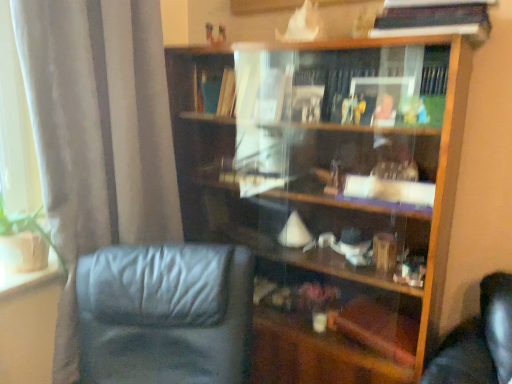
Question: Considering the relative sizes of black leather chair at lower left and hardcover book at upper right in the image provided, is black leather chair at lower left taller than hardcover book at upper right?

Choices:
 (A) yes
 (B) no

Answer: (A)

Question: From a real-world perspective, does black leather chair at lower left stand above hardcover book at upper right?

Choices:
 (A) yes
 (B) no

Answer: (B)

Question: Considering the relative positions of black leather chair at lower left and hardcover book at upper right in the image provided, is black leather chair at lower left to the left of hardcover book at upper right from the viewer's perspective?

Choices:
 (A) yes
 (B) no

Answer: (A)

Question: Considering the relative sizes of black leather chair at lower left and hardcover book at upper right in the image provided, is black leather chair at lower left wider than hardcover book at upper right?

Choices:
 (A) yes
 (B) no

Answer: (A)

Question: Is black leather chair at lower left at the right side of hardcover book at upper right?

Choices:
 (A) no
 (B) yes

Answer: (A)

Question: Considering the positions of hardcover book at upper right and wooden bookcase at center in the image, is hardcover book at upper right taller or shorter than wooden bookcase at center?

Choices:
 (A) tall
 (B) short

Answer: (B)

Question: Does point (415, 14) appear closer or farther from the camera than point (425, 225)?

Choices:
 (A) farther
 (B) closer

Answer: (B)

Question: In terms of size, does hardcover book at upper right appear bigger or smaller than wooden bookcase at center?

Choices:
 (A) small
 (B) big

Answer: (A)

Question: From a real-world perspective, relative to wooden bookcase at center, is hardcover book at upper right vertically above or below?

Choices:
 (A) above
 (B) below

Answer: (A)

Question: Does point (238, 382) appear closer or farther from the camera than point (125, 86)?

Choices:
 (A) closer
 (B) farther

Answer: (A)

Question: Looking at their shapes, would you say black leather chair at lower left is wider or thinner than satin gray curtain at left?

Choices:
 (A) wide
 (B) thin

Answer: (A)

Question: Relative to satin gray curtain at left, is black leather chair at lower left in front or behind?

Choices:
 (A) front
 (B) behind

Answer: (A)

Question: From the image's perspective, is black leather chair at lower left above or below satin gray curtain at left?

Choices:
 (A) above
 (B) below

Answer: (B)

Question: Does point 61,327 appear closer or farther from the camera than point 443,24?

Choices:
 (A) closer
 (B) farther

Answer: (B)

Question: Choose the correct answer: Is satin gray curtain at left inside hardcover book at upper right or outside it?

Choices:
 (A) outside
 (B) inside

Answer: (A)